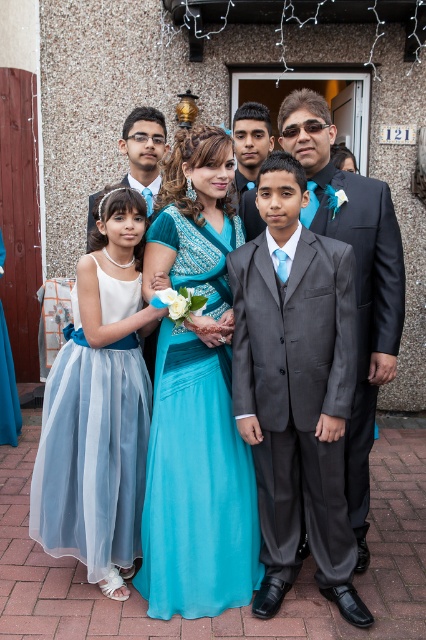
Is point (190, 426) positioned before point (95, 205)?

That is True.

Between turquoise satin dress at center and matte black suit at center, which one appears on the right side from the viewer's perspective?

From the viewer's perspective, turquoise satin dress at center appears more on the right side.

Which is in front, point (236, 604) or point (92, 216)?

Point (236, 604) is more forward.

Where is `turquoise satin dress at center`? This screenshot has width=426, height=640. turquoise satin dress at center is located at coordinates (196, 486).

Is turquoise satin dress at center positioned at the back of matte gray suit at center?

No, it is in front of matte gray suit at center.

Does turquoise satin dress at center come in front of matte gray suit at center?

Yes, it is.

Between point (213, 392) and point (253, 177), which one is positioned in front?

Positioned in front is point (213, 392).

Where is `turquoise satin dress at center`? turquoise satin dress at center is located at coordinates (196, 486).

Between point (367, 195) and point (253, 150), which one is positioned in front?

Point (367, 195) is in front.

Locate an element on the screen. shiny black suit at center is located at coordinates (356, 276).

Between point (321, 125) and point (250, 131), which one is positioned in front?

Point (321, 125) is more forward.

This screenshot has width=426, height=640. Identify the location of shiny black suit at center. (356, 276).